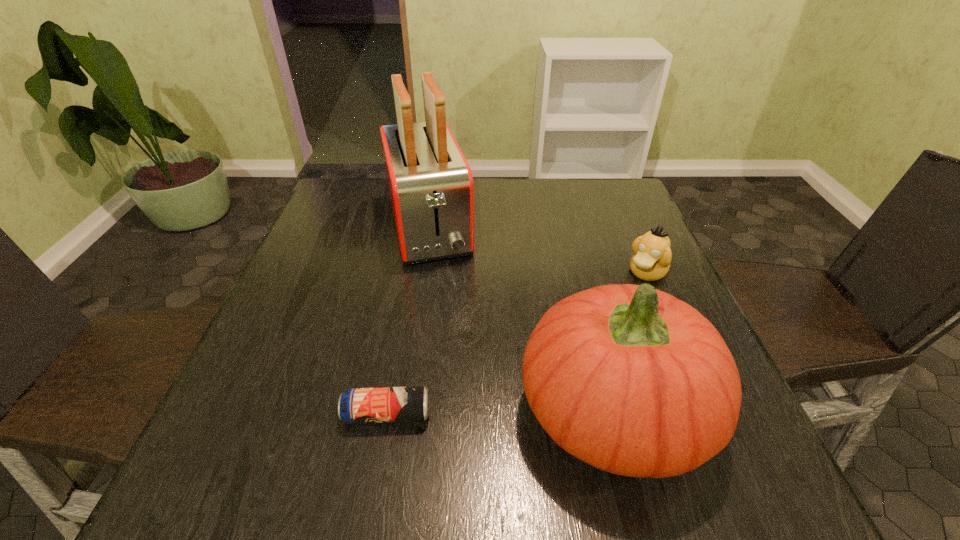
In order to click on vacant space at the left edge of the desktop in this screenshot , I will do `click(348, 228)`.

The height and width of the screenshot is (540, 960). I want to click on free space at the right edge of the desktop, so click(598, 237).

Where is `vacant area at the far left corner of the desktop`? This screenshot has height=540, width=960. vacant area at the far left corner of the desktop is located at coordinates (352, 194).

Identify the location of vacant area at the near left corner. (279, 428).

Image resolution: width=960 pixels, height=540 pixels. Find the location of `free space at the far right corner of the desktop`. free space at the far right corner of the desktop is located at coordinates (615, 189).

Where is `free space between the pumpkin and the shortest object`? The image size is (960, 540). free space between the pumpkin and the shortest object is located at coordinates point(501,412).

I want to click on free space between the third shortest object and the shortest object, so click(x=501, y=412).

Identify the location of free space between the second tallest object and the toaster. (521, 318).

Locate an element on the screen. free spot between the second shortest object and the tallest object is located at coordinates (538, 249).

Identify the location of vacant space that is in between the duckling and the shortest object. (517, 343).